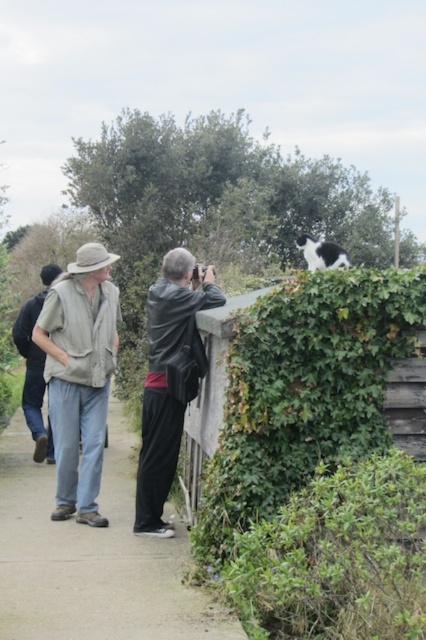
Question: Which object appears farthest from the camera in this image?

Choices:
 (A) khaki cotton shirt at left
 (B) black and white fur at upper center

Answer: (B)

Question: Among these objects, which one is nearest to the camera?

Choices:
 (A) black and white fur at upper center
 (B) khaki cotton shirt at left

Answer: (B)

Question: In this image, where is green ivy hedge at upper right located relative to black and white fur at upper center?

Choices:
 (A) right
 (B) left

Answer: (B)

Question: Which point is farther to the camera?

Choices:
 (A) black leather jacket at center
 (B) green ivy hedge at upper right
 (C) light brown fabric shirt at left
 (D) concrete sidewalk at lower center

Answer: (C)

Question: Can you confirm if black leather jacket at center is thinner than khaki cotton shirt at left?

Choices:
 (A) yes
 (B) no

Answer: (B)

Question: Can you confirm if light brown fabric shirt at left is positioned to the right of khaki cotton shirt at left?

Choices:
 (A) yes
 (B) no

Answer: (A)